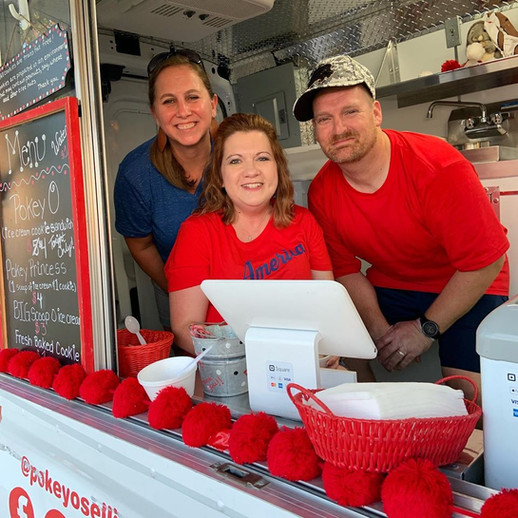
Find the location of `lightswitch`. lightswitch is located at coordinates (451, 30).